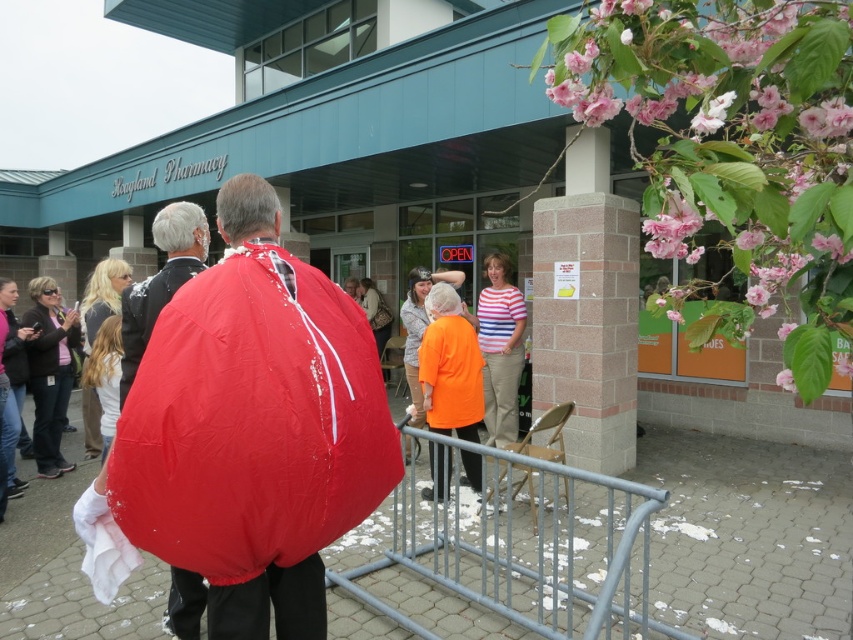
This screenshot has height=640, width=853. What do you see at coordinates (161, 280) in the screenshot? I see `matte red cape at center` at bounding box center [161, 280].

Does matte red cape at center lie in front of matte black jacket at lower left?

Yes, matte red cape at center is in front of matte black jacket at lower left.

Locate an element on the screen. This screenshot has width=853, height=640. matte red cape at center is located at coordinates (161, 280).

Identify the location of matte red cape at center. (161, 280).

Is matte nylon sleeping bag at center above gray metal rail at center?

Yes.

Is matte nylon sleeping bag at center behind gray metal rail at center?

No, it is in front of gray metal rail at center.

Between point (148, 435) and point (421, 627), which one is positioned behind?

Point (421, 627)

At what (x,y) coordinates should I click in order to perform the action: click on matte nylon sleeping bag at center. Please return your answer as a coordinate pair (x, y). Image resolution: width=853 pixels, height=640 pixels. Looking at the image, I should click on (252, 420).

Can you confirm if gray metal rail at center is positioned below striped fabric shirt at center?

Yes.

The width and height of the screenshot is (853, 640). Find the location of `gray metal rail at center`. gray metal rail at center is located at coordinates (524, 544).

At what (x,y) coordinates should I click in order to perform the action: click on gray metal rail at center. Please return your answer as a coordinate pair (x, y). Looking at the image, I should click on pos(524,544).